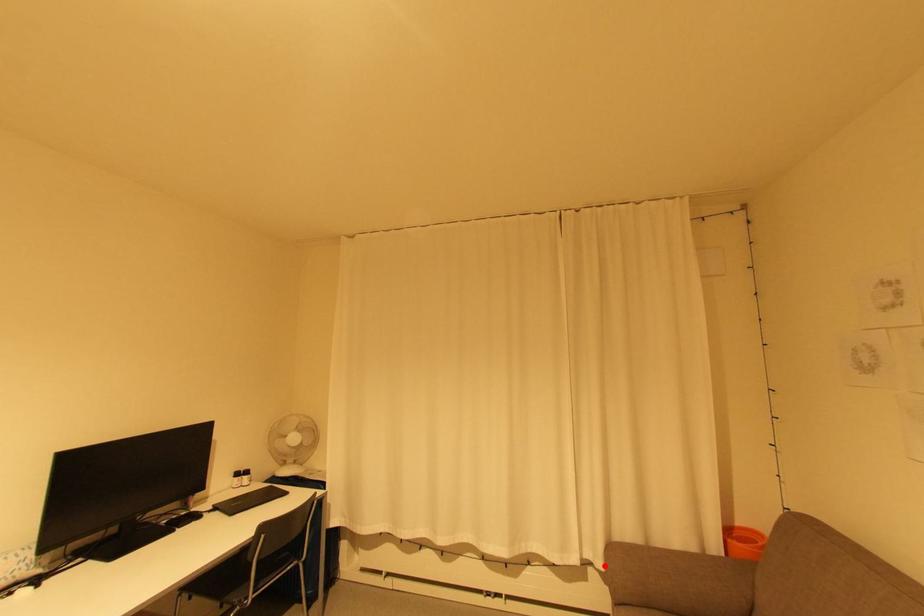
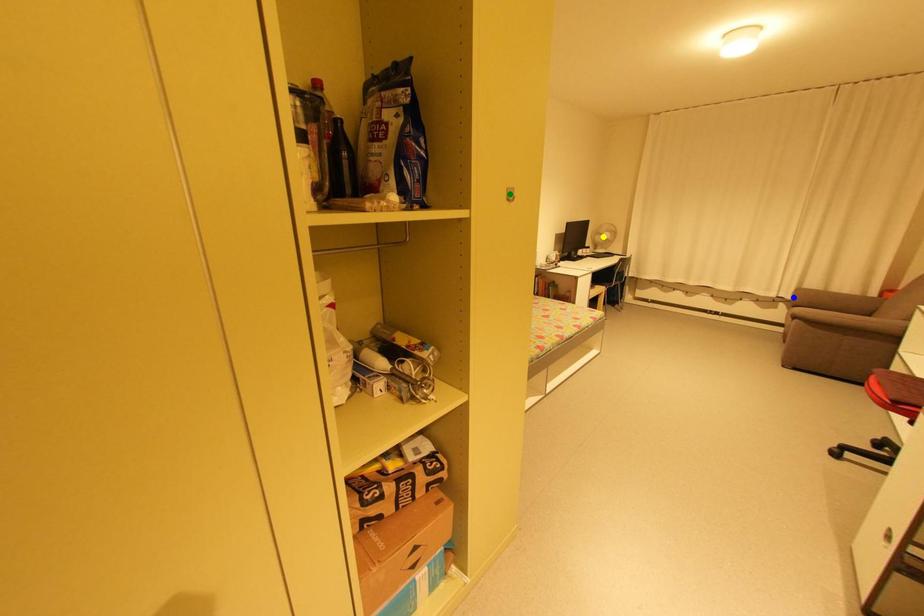
Question: I am providing you with two images of the same scene from different viewpoints. A red point is marked on the first image. You are given multiple points on the second image. Can you choose the point in image 2 that corresponds to the point in image 1?

Choices:
 (A) green point
 (B) yellow point
 (C) blue point

Answer: (C)